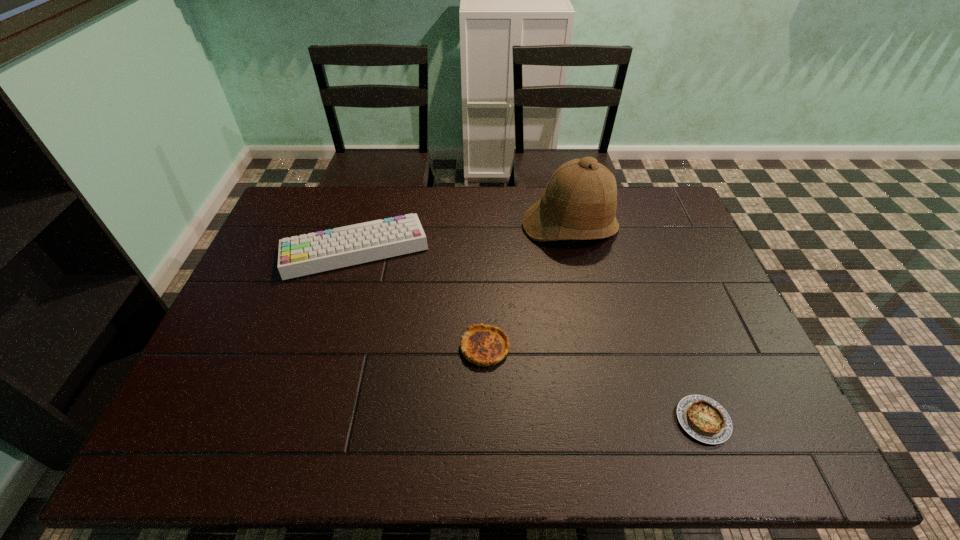
Where is `the tallest object`? The height and width of the screenshot is (540, 960). the tallest object is located at coordinates (579, 202).

Find the location of a particular element. This screenshot has width=960, height=540. computer keyboard is located at coordinates (302, 255).

Where is `the leftmost object`? The image size is (960, 540). the leftmost object is located at coordinates (302, 255).

You are a GUI agent. You are given a task and a screenshot of the screen. Output one action in this format:
    pyautogui.click(x=<x>, y=<y>)
    Task: Click on the third object from right to left
    This screenshot has width=960, height=540.
    Given the screenshot: What is the action you would take?
    click(484, 345)

The height and width of the screenshot is (540, 960). In order to click on the farther quiche in this screenshot , I will do `click(484, 345)`.

The width and height of the screenshot is (960, 540). I want to click on the shorter quiche, so click(x=704, y=419).

Find the location of a particular element. the shortest object is located at coordinates (704, 419).

Find the location of `free spot located 0.180m on the front-facing side of the tallest object`. free spot located 0.180m on the front-facing side of the tallest object is located at coordinates (586, 294).

At what (x,y) coordinates should I click in order to perform the action: click on vacant space located on the front of the computer keyboard. Please return your answer as a coordinate pair (x, y). The width and height of the screenshot is (960, 540). Looking at the image, I should click on (333, 323).

Where is `free region located on the left of the second shortest object`? The width and height of the screenshot is (960, 540). free region located on the left of the second shortest object is located at coordinates (411, 347).